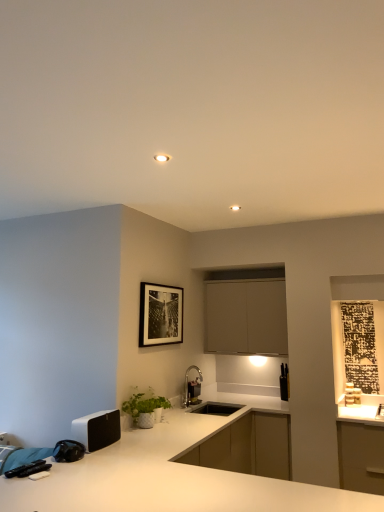
Question: Does point (283, 389) appear closer or farther from the camera than point (132, 397)?

Choices:
 (A) closer
 (B) farther

Answer: (B)

Question: From a real-world perspective, is black matte knife block at right, which appears as the third appliance when viewed from the front, above or below white ceramic plant at lower center?

Choices:
 (A) below
 (B) above

Answer: (B)

Question: Which of these objects is positioned farthest from the white ceramic plant at lower center?

Choices:
 (A) black matte picture frame at upper center
 (B) metallic silver faucet at center, positioned as the second appliance in left-to-right order
 (C) matte white cabinet at center
 (D) black matte knife block at right, the third appliance viewed from the left
 (E) white glossy countertop at center

Answer: (D)

Question: Estimate the real-world distances between objects in this image. Which object is farther from the black matte picture frame at upper center?

Choices:
 (A) matte white cabinet at center
 (B) metallic silver faucet at center, the 2th appliance when ordered from right to left
 (C) black matte knife block at right, arranged as the first appliance when viewed from the back
 (D) white ceramic plant at lower center
 (E) white matte speaker at lower left, the first appliance when ordered from left to right

Answer: (C)